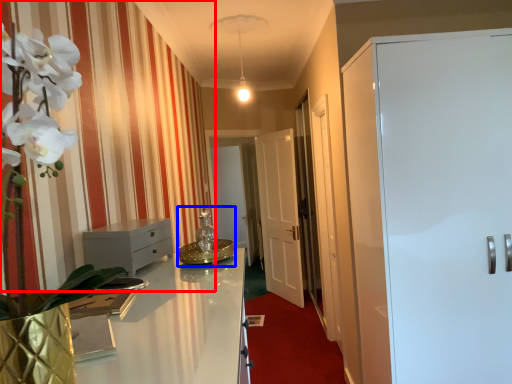
Question: Among these objects, which one is farthest to the camera, curtain (highlighted by a red box) or sink (highlighted by a blue box)?

Choices:
 (A) curtain
 (B) sink

Answer: (B)